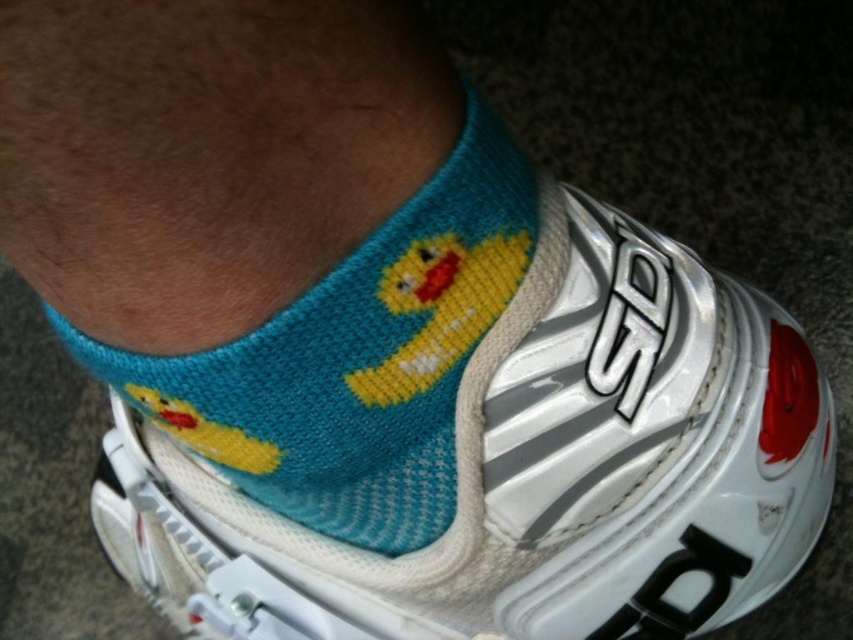
Question: Which point is closer to the camera?

Choices:
 (A) white mesh shoe at center
 (B) teal knitted socks at center

Answer: (B)

Question: Which point is farther to the camera?

Choices:
 (A) teal knitted socks at center
 (B) white mesh shoe at center

Answer: (B)

Question: Which of the following is the closest to the observer?

Choices:
 (A) teal knitted socks at center
 (B) white mesh shoe at center

Answer: (A)

Question: Can you confirm if white mesh shoe at center is positioned to the right of teal knitted socks at center?

Choices:
 (A) yes
 (B) no

Answer: (A)

Question: Does white mesh shoe at center have a larger size compared to teal knitted socks at center?

Choices:
 (A) no
 (B) yes

Answer: (B)

Question: Does white mesh shoe at center appear over teal knitted socks at center?

Choices:
 (A) no
 (B) yes

Answer: (A)